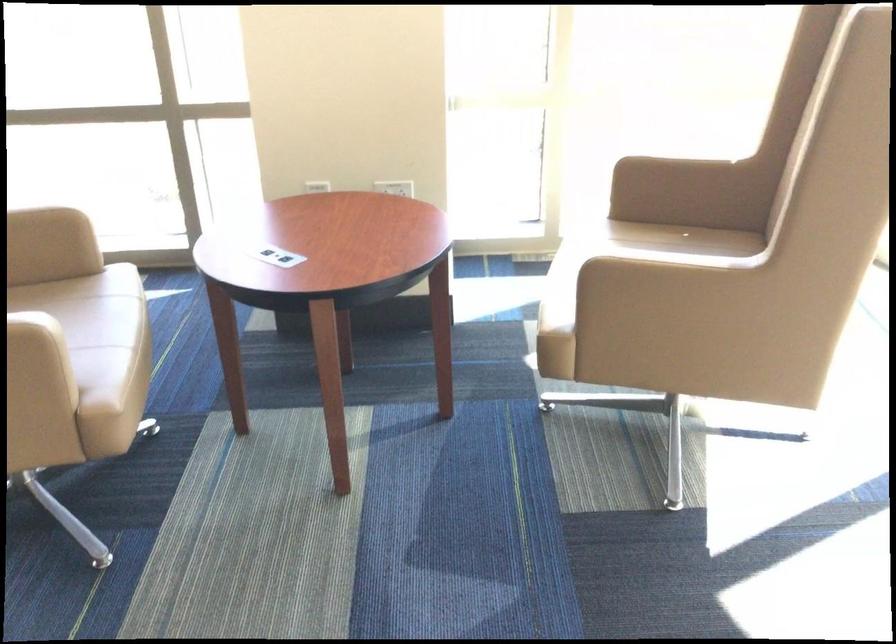
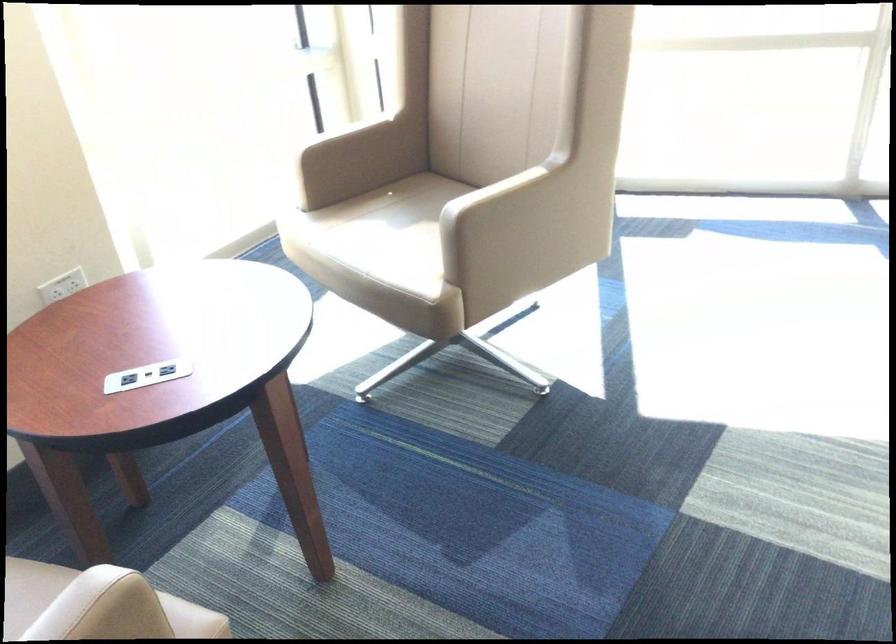
The point at (383, 183) is marked in the first image. Where is the corresponding point in the second image?

(62, 286)